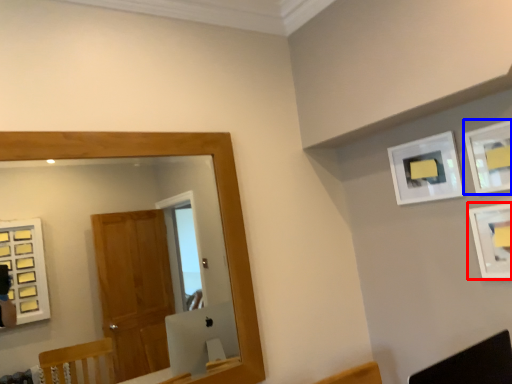
Question: Among these objects, which one is farthest to the camera, picture frame (highlighted by a red box) or picture frame (highlighted by a blue box)?

Choices:
 (A) picture frame
 (B) picture frame

Answer: (B)